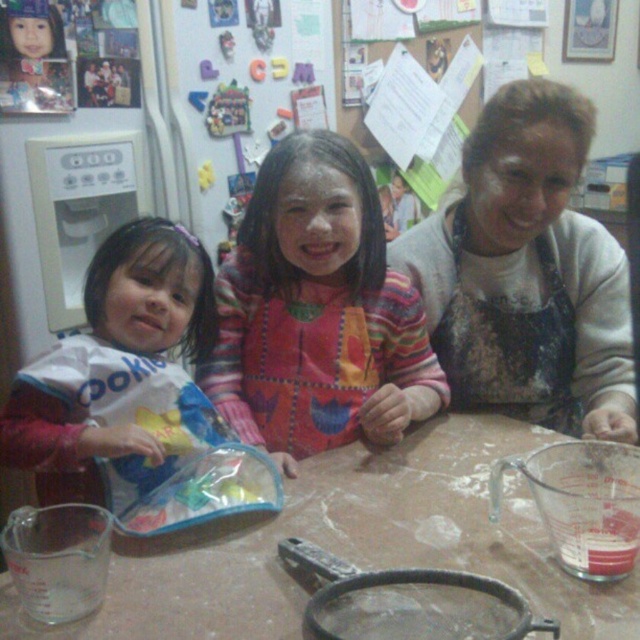
Can you confirm if transparent plastic table at center is taller than white paper bag at left?

No, transparent plastic table at center is not taller than white paper bag at left.

Between transparent plastic table at center and white paper bag at left, which one has less height?

With less height is transparent plastic table at center.

Does point (438, 484) come closer to viewer compared to point (196, 250)?

Yes, point (438, 484) is closer to viewer.

The image size is (640, 640). In order to click on transparent plastic table at center in this screenshot , I will do `click(349, 545)`.

Can you confirm if dark gray apron at center is bigger than multicolored fabric dress at center?

Yes.

Between dark gray apron at center and multicolored fabric dress at center, which one has less height?

Standing shorter between the two is multicolored fabric dress at center.

Is point (554, 305) less distant than point (260, 356)?

No, (554, 305) is further to viewer.

Where is `dark gray apron at center`? dark gray apron at center is located at coordinates (528, 273).

Does dark gray apron at center have a larger size compared to white paper bag at left?

Indeed, dark gray apron at center has a larger size compared to white paper bag at left.

Does point (490, 161) come in front of point (147, 236)?

That is False.

What are the coordinates of `dark gray apron at center` in the screenshot? It's located at (528, 273).